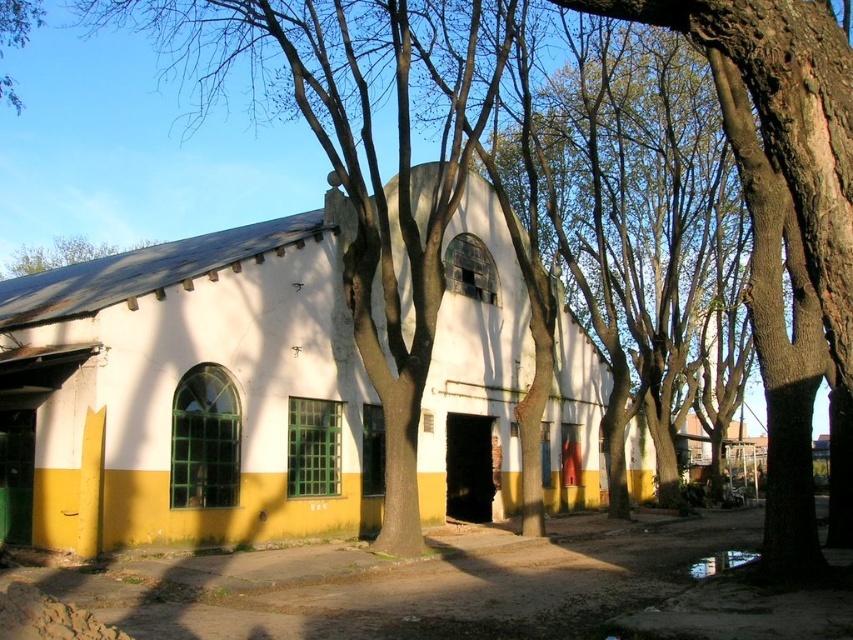
Is rough bark tree at center in front of brown bark tree at upper left?

Yes, it is.

Can you confirm if rough bark tree at center is shorter than brown bark tree at upper left?

Indeed, rough bark tree at center has a lesser height compared to brown bark tree at upper left.

The image size is (853, 640). Describe the element at coordinates (782, 216) in the screenshot. I see `rough bark tree at center` at that location.

This screenshot has width=853, height=640. Identify the location of rough bark tree at center. (782, 216).

Between point (761, 348) and point (47, 248), which one is positioned behind?

The point (47, 248) is behind.

What do you see at coordinates (782, 216) in the screenshot?
I see `rough bark tree at center` at bounding box center [782, 216].

Image resolution: width=853 pixels, height=640 pixels. Find the location of `rough bark tree at center`. rough bark tree at center is located at coordinates (782, 216).

Who is positioned more to the right, white matte building at center or green leafy tree at upper left?

From the viewer's perspective, white matte building at center appears more on the right side.

Between white matte building at center and green leafy tree at upper left, which one is positioned higher?

green leafy tree at upper left is above.

The width and height of the screenshot is (853, 640). I want to click on white matte building at center, so click(x=190, y=394).